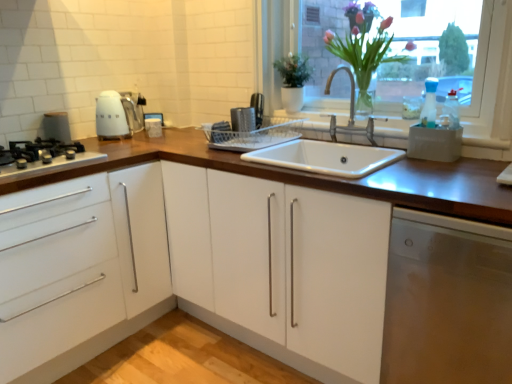
Where is `matte white kettle at left, placed as the 1th appliance when sorted from left to right`? matte white kettle at left, placed as the 1th appliance when sorted from left to right is located at coordinates (57, 126).

What is the approximate height of metallic silver dish rack at center, which appears as the first appliance when viewed from the right?

It is 14.70 centimeters.

Locate an element on the screen. white glossy kettle at upper left is located at coordinates (116, 116).

This screenshot has width=512, height=384. What do you see at coordinates (41, 158) in the screenshot?
I see `black matte gas stove at left` at bounding box center [41, 158].

Find the location of a particular element. The height and width of the screenshot is (384, 512). translucent glass vase at upper right is located at coordinates (362, 47).

Where is `wooden at center`? The width and height of the screenshot is (512, 384). wooden at center is located at coordinates (313, 175).

Is wooden at center inside stainless steel dishwasher at lower right?

No, wooden at center is located outside of stainless steel dishwasher at lower right.

Would you say stainless steel dishwasher at lower right is to the left or to the right of wooden at center in the picture?

From the image, it's evident that stainless steel dishwasher at lower right is to the right of wooden at center.

Considering the sizes of stainless steel dishwasher at lower right and wooden at center in the image, is stainless steel dishwasher at lower right wider or thinner than wooden at center?

In the image, stainless steel dishwasher at lower right appears to be more narrow than wooden at center.

What's the angular difference between stainless steel dishwasher at lower right and wooden at center's facing directions?

stainless steel dishwasher at lower right and wooden at center are facing 0.0307 degrees away from each other.

From a real-world perspective, is white glossy cabinet at left below white glossy kettle at upper left?

Yes.

From the image's perspective, between white glossy cabinet at left and white glossy kettle at upper left, who is located below?

white glossy cabinet at left appears lower in the image.

Is white glossy cabinet at left further to camera compared to white glossy kettle at upper left?

No, white glossy cabinet at left is closer to the viewer.

Between white glossy cabinet at left and white glossy kettle at upper left, which one has smaller width?

white glossy kettle at upper left.

Based on their positions, is stainless steel dishwasher at lower right located to the left or right of translucent glass vase at upper right?

stainless steel dishwasher at lower right is to the right of translucent glass vase at upper right.

Which is in front, stainless steel dishwasher at lower right or translucent glass vase at upper right?

Positioned in front is stainless steel dishwasher at lower right.

Who is smaller, stainless steel dishwasher at lower right or translucent glass vase at upper right?

translucent glass vase at upper right.

Are stainless steel dishwasher at lower right and translucent glass vase at upper right making contact?

No, stainless steel dishwasher at lower right is not beside translucent glass vase at upper right.

How much distance is there between black matte gas stove at left and stainless steel dishwasher at lower right?

4.59 feet.

From a real-world perspective, between black matte gas stove at left and stainless steel dishwasher at lower right, who is vertically lower?

stainless steel dishwasher at lower right.

Based on the photo, is black matte gas stove at left in front of or behind stainless steel dishwasher at lower right in the image?

Clearly, black matte gas stove at left is behind stainless steel dishwasher at lower right.

Which is more distant, (368, 85) or (207, 149)?

The point (368, 85) is more distant.

Considering the relative sizes of translucent glass vase at upper right and wooden at center in the image provided, is translucent glass vase at upper right taller than wooden at center?

No, translucent glass vase at upper right is not taller than wooden at center.

Considering the sizes of translucent glass vase at upper right and wooden at center in the image, is translucent glass vase at upper right wider or thinner than wooden at center?

A: In the image, translucent glass vase at upper right appears to be more narrow than wooden at center.

Does translucent glass vase at upper right turn towards wooden at center?

No, translucent glass vase at upper right is not aimed at wooden at center.

From a real-world perspective, which object rests below the other?

In real-world perspective, black matte gas stove at left is lower.

From the image's perspective, between black matte gas stove at left and translucent glass vase at upper right, which one is located above?

translucent glass vase at upper right appears higher in the image.

How many degrees apart are the facing directions of black matte gas stove at left and translucent glass vase at upper right?

The angular difference between black matte gas stove at left and translucent glass vase at upper right is 88.6 degrees.

Is black matte gas stove at left positioned with its back to translucent glass vase at upper right?

No, black matte gas stove at left is not facing away from translucent glass vase at upper right.

Is white glossy kettle at upper left outside of matte white kettle at left, placed as the 1th appliance when sorted from left to right?

white glossy kettle at upper left is positioned outside matte white kettle at left, placed as the 1th appliance when sorted from left to right.

Would you consider white glossy kettle at upper left to be distant from matte white kettle at left, the second appliance viewed from the right?

white glossy kettle at upper left is actually quite close to matte white kettle at left, the second appliance viewed from the right.

From the image's perspective, relative to matte white kettle at left, the second appliance viewed from the right, is white glossy kettle at upper left above or below?

From the image's perspective, white glossy kettle at upper left appears above matte white kettle at left, the second appliance viewed from the right.

Is white glossy kettle at upper left turned away from matte white kettle at left, placed as the 1th appliance when sorted from left to right?

No, white glossy kettle at upper left's orientation is not away from matte white kettle at left, placed as the 1th appliance when sorted from left to right.

I want to click on countertop that appears above the stainless steel dishwasher at lower right (from the image's perspective), so click(313, 175).

There is a white glossy cabinet at left. Where is `kitchen appliance above it (from a real-world perspective)`? Image resolution: width=512 pixels, height=384 pixels. kitchen appliance above it (from a real-world perspective) is located at coordinates (116, 116).

Considering their positions, is matte white kettle at left, the second appliance viewed from the right, positioned further to metallic silver dish rack at center, which appears as the first appliance when viewed from the right, than white glossy kettle at upper left?

The object further to metallic silver dish rack at center, which appears as the first appliance when viewed from the right, is matte white kettle at left, the second appliance viewed from the right.

Estimate the real-world distances between objects in this image. Which object is closer to stainless steel dishwasher at lower right, metallic silver dish rack at center, which appears as the first appliance when viewed from the right, or translucent glass vase at upper right?

translucent glass vase at upper right.

When comparing their distances from translucent glass vase at upper right, does white glossy cabinet at left or wooden at center seem further?

Based on the image, white glossy cabinet at left appears to be further to translucent glass vase at upper right.

In the scene shown: Based on their spatial positions, is matte white kettle at left, the second appliance viewed from the right, or black matte gas stove at left closer to translucent glass vase at upper right?

Among the two, black matte gas stove at left is located nearer to translucent glass vase at upper right.

Consider the image. From the image, which object appears to be nearer to metallic silver dish rack at center, positioned as the 2th appliance in left-to-right order, translucent glass vase at upper right or white glossy kettle at upper left?

translucent glass vase at upper right is closer to metallic silver dish rack at center, positioned as the 2th appliance in left-to-right order.

When comparing their distances from wooden at center, does white glossy kettle at upper left or matte white kettle at left, the second appliance viewed from the right, seem further?

matte white kettle at left, the second appliance viewed from the right, is positioned further to the anchor wooden at center.

Looking at this image, based on their spatial positions, is wooden at center or matte white kettle at left, the second appliance viewed from the right, further from stainless steel dishwasher at lower right?

Based on the image, matte white kettle at left, the second appliance viewed from the right, appears to be further to stainless steel dishwasher at lower right.

Looking at the image, which one is located further to metallic silver dish rack at center, positioned as the 2th appliance in left-to-right order, matte white kettle at left, placed as the 1th appliance when sorted from left to right, or white glossy cabinet at left?

matte white kettle at left, placed as the 1th appliance when sorted from left to right, lies further to metallic silver dish rack at center, positioned as the 2th appliance in left-to-right order, than the other object.

Locate an element on the screen. The width and height of the screenshot is (512, 384). kitchen appliance located between black matte gas stove at left and stainless steel dishwasher at lower right in the left-right direction is located at coordinates (116, 116).

Identify the location of appliance situated between white glossy kettle at upper left and translucent glass vase at upper right from left to right. (243, 120).

What are the coordinates of `appliance between white glossy cabinet at left and translucent glass vase at upper right` in the screenshot? It's located at (243, 120).

Image resolution: width=512 pixels, height=384 pixels. Find the location of `kitchen appliance between matte white kettle at left, placed as the 1th appliance when sorted from left to right, and metallic silver dish rack at center, which appears as the first appliance when viewed from the right`. kitchen appliance between matte white kettle at left, placed as the 1th appliance when sorted from left to right, and metallic silver dish rack at center, which appears as the first appliance when viewed from the right is located at coordinates (116, 116).